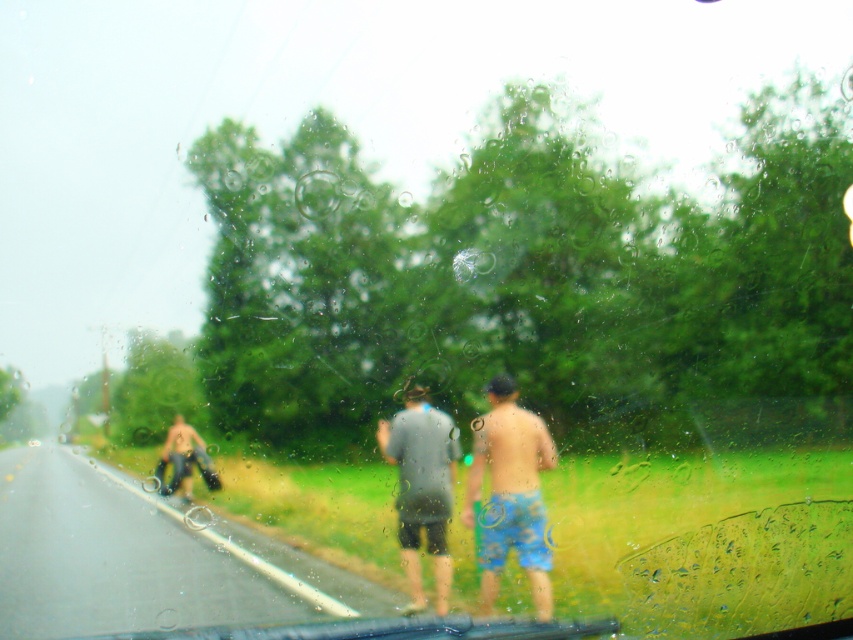
You are a passenger in the car and notice two people outside through the rainy windshield. Which clothing item, the gray matte shirt at center or the denim jeans at left, appears narrower from your viewpoint?

The gray matte shirt at center appears narrower compared to the denim jeans at left because it has a lesser width according to the description.

You are a photographer trying to capture a clear image of the blue printed shorts at right and the gray matte shirt at center through the rain streaked windshield. Which object would appear more blurred due to its size in the photo?

The blue printed shorts at right appears larger in the photo, so it would be more blurred compared to the gray matte shirt at center because larger objects tend to be more affected by the rain streaks on the windshield.